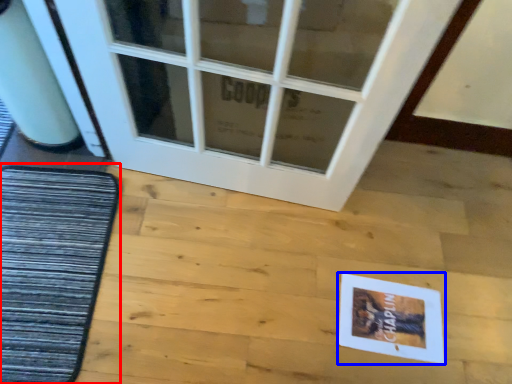
Question: Which of the following is the farthest to the observer, mat (highlighted by a red box) or postcard (highlighted by a blue box)?

Choices:
 (A) mat
 (B) postcard

Answer: (B)